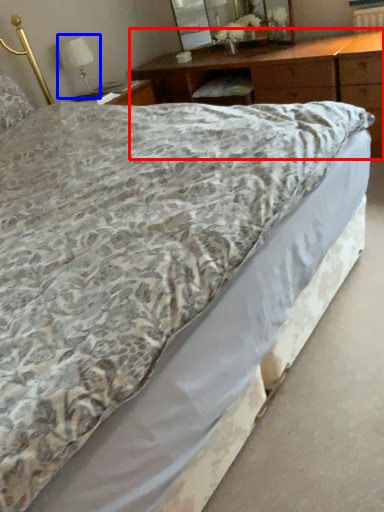
Question: Which object is closer to the camera taking this photo, nightstand (highlighted by a red box) or table lamp (highlighted by a blue box)?

Choices:
 (A) nightstand
 (B) table lamp

Answer: (A)